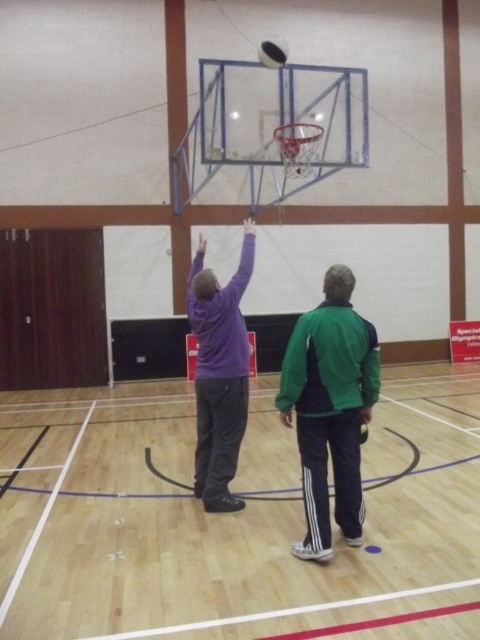
You are standing at the point labeled point (x=268, y=49) and want to throw a ball to the point labeled point (x=82, y=616). Is there a clear path between these two points without any obstacles?

Yes, there is a clear path between point (x=268, y=49) and point (x=82, y=616) because point (x=82, y=616) is in front of point (x=268, y=49), meaning there are no objects blocking the line of sight between them.

You are a photographer standing at the side of the basketball court. You want to take a photo of the purple fleece jacket at center and the glossy black basketball at upper center. Which object will appear bigger in your photo?

The purple fleece jacket at center will appear bigger in the photo because it is larger in size than the glossy black basketball at upper center.